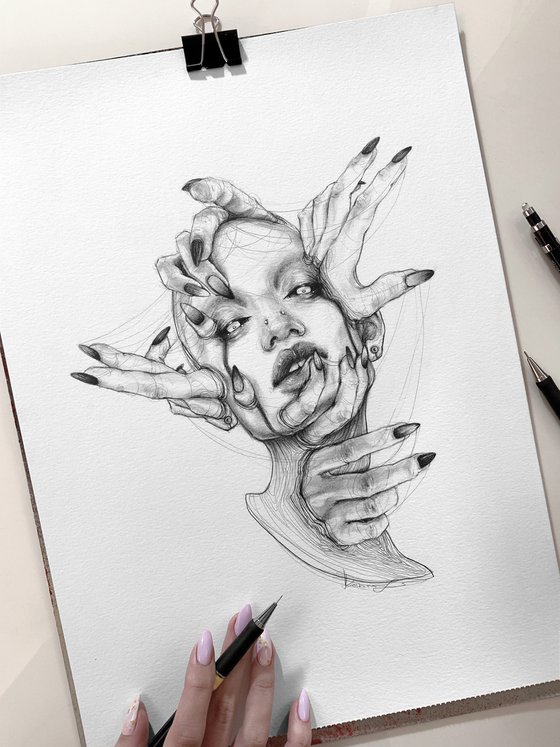
Identify the location of black rectangle shaped binder clip. (210, 51).